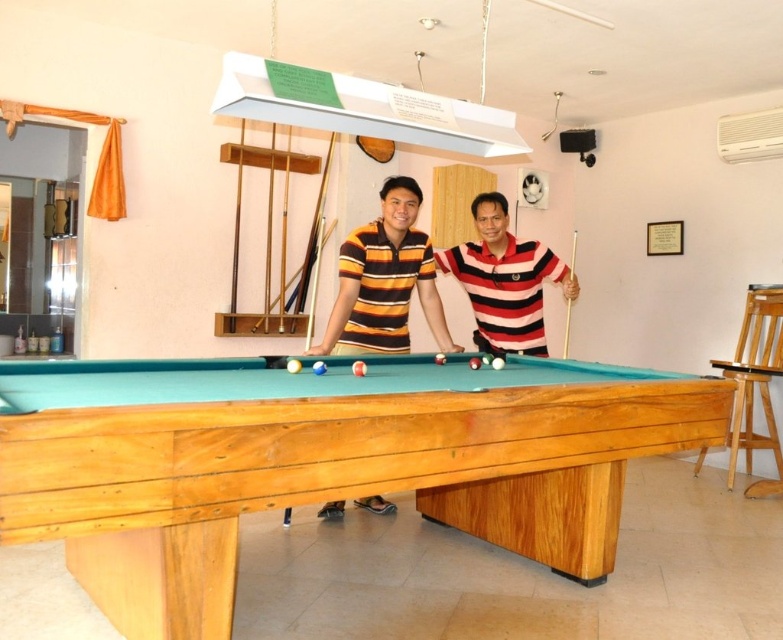
You are standing at the entrance of the room and want to locate the striped jersey at center. According to the coordinates provided, where should you look to find it?

The striped jersey at center is located at coordinates point (384,280), so you should look towards the center of the room to find it.

You are a photographer trying to capture a photo of the natural wood billiard table at center and the striped polo shirt at center from the floor. Will the table appear taller than the shirt in the photo?

The natural wood billiard table at center is taller than the striped polo shirt at center, so yes, the table will appear taller in the photo.